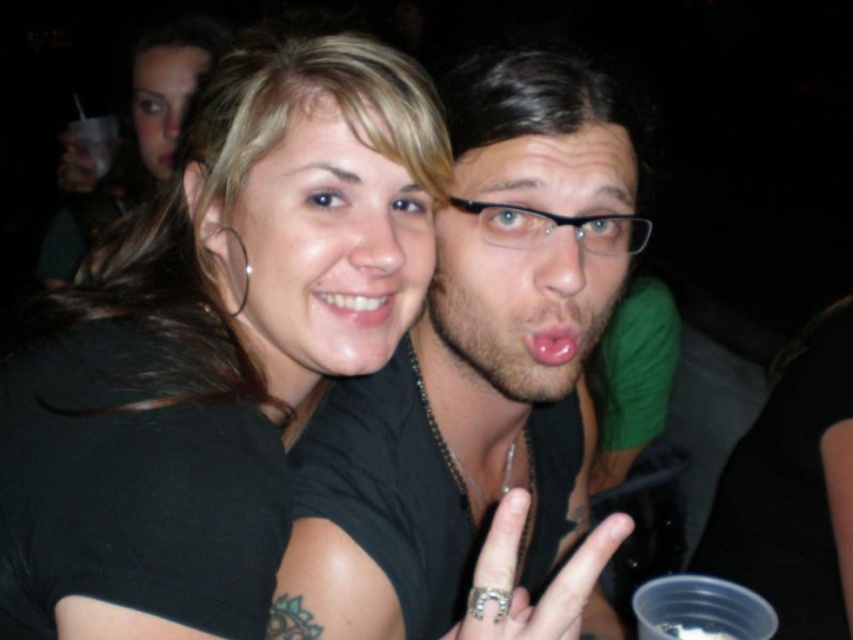
Question: Estimate the real-world distances between objects in this image. Which object is farther from the matte black shirt at center?

Choices:
 (A) matte black face at center
 (B) black plastic glasses at center

Answer: (B)

Question: Which point is farther from the camera taking this photo?

Choices:
 (A) (172, 68)
 (B) (410, 346)
 (C) (474, 211)

Answer: (A)

Question: Can you confirm if matte black shirt at center is bigger than matte black face at center?

Choices:
 (A) no
 (B) yes

Answer: (B)

Question: Estimate the real-world distances between objects in this image. Which object is farther from the smooth skin face at upper left?

Choices:
 (A) matte black face at center
 (B) matte black hair at center
 (C) black plastic glasses at center
 (D) black matte hair at upper left

Answer: (C)

Question: Does black matte hair at upper left have a lesser width compared to smooth skin face at upper left?

Choices:
 (A) yes
 (B) no

Answer: (B)

Question: Can you confirm if matte black hair at center is positioned to the left of matte black face at center?

Choices:
 (A) yes
 (B) no

Answer: (A)